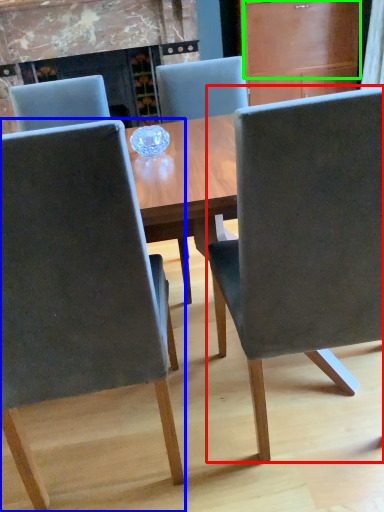
Question: Which object is the closest to the chair (highlighted by a red box)? Choose among these: chair (highlighted by a blue box) or drawer (highlighted by a green box).

Choices:
 (A) chair
 (B) drawer

Answer: (A)